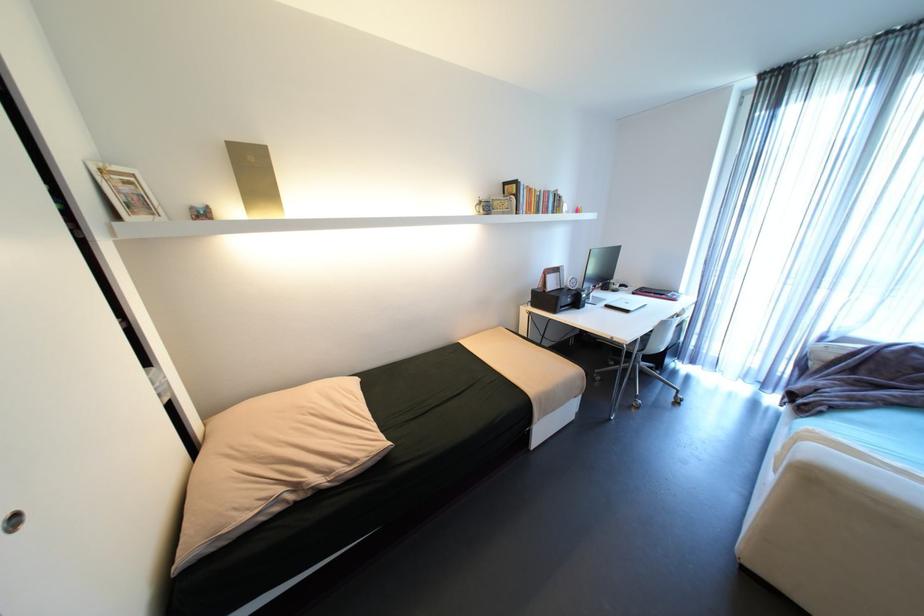
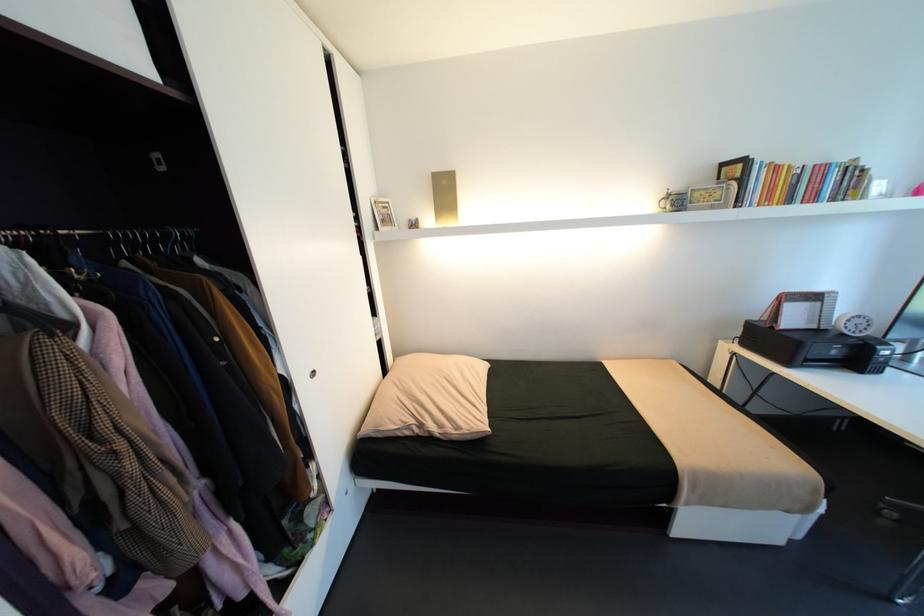
Question: I am providing you with two images of the same scene from different viewpoints. After the viewpoint changes to image2, which objects are now occluded?

Choices:
 (A) small white mug
 (B) recessed door pull
 (C) tan pillow
 (D) none of these

Answer: (D)